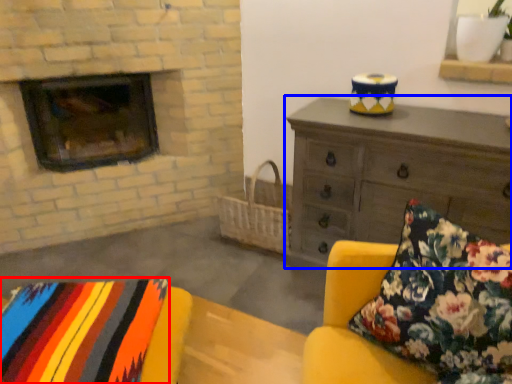
Question: Which point is closer to the camera, blanket (highlighted by a red box) or chest of drawers (highlighted by a blue box)?

Choices:
 (A) blanket
 (B) chest of drawers

Answer: (A)